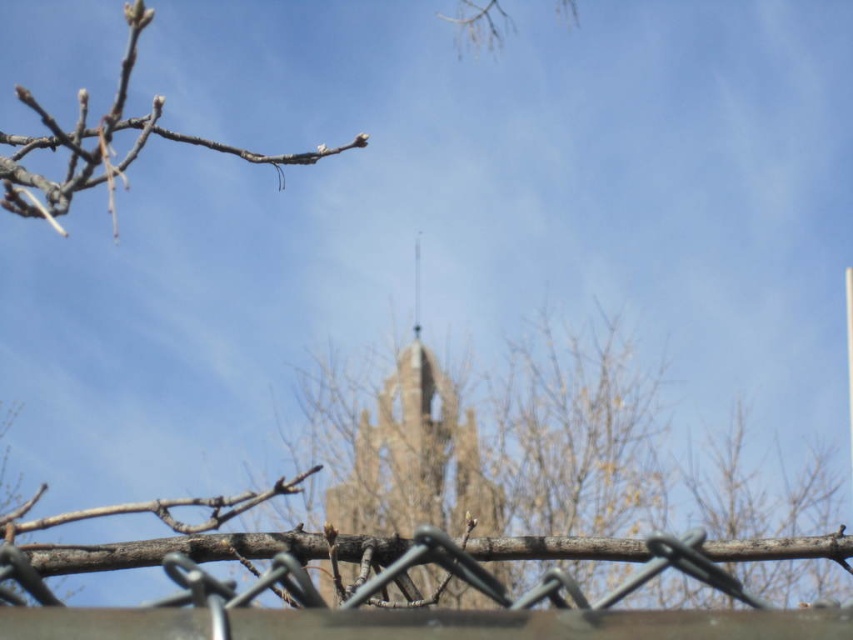
Question: Does metallic wire fence at lower center appear on the right side of bare wood branch at upper left?

Choices:
 (A) yes
 (B) no

Answer: (A)

Question: Which point is closer to the camera?

Choices:
 (A) (59, 202)
 (B) (740, 616)

Answer: (B)

Question: Does metallic wire fence at lower center lie behind bare wood branch at upper left?

Choices:
 (A) no
 (B) yes

Answer: (A)

Question: Is metallic wire fence at lower center behind bare wood branch at upper left?

Choices:
 (A) yes
 (B) no

Answer: (B)

Question: Among these points, which one is nearest to the camera?

Choices:
 (A) (73, 161)
 (B) (454, 625)

Answer: (B)